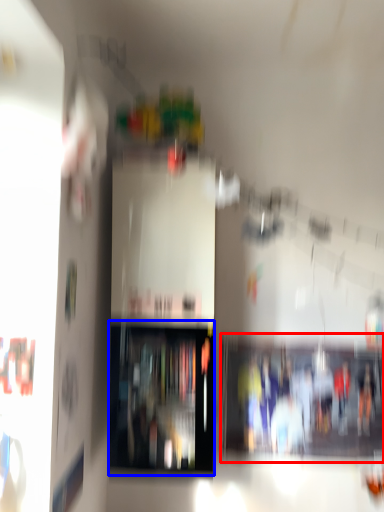
Question: Which point is closer to the camera, shelf (highlighted by a red box) or shelf (highlighted by a blue box)?

Choices:
 (A) shelf
 (B) shelf

Answer: (B)